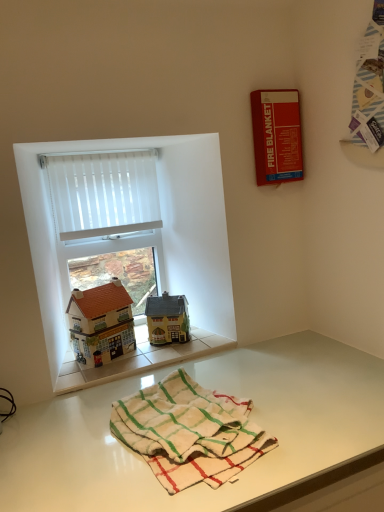
At what (x,y) coordinates should I click in order to perform the action: click on free space above white glossy table at lower center (from a real-world perspective). Please return your answer as a coordinate pair (x, y). Looking at the image, I should click on (207, 387).